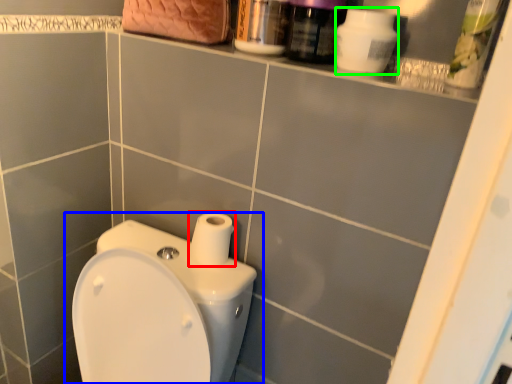
Question: Estimate the real-world distances between objects in this image. Which object is farther from toilet paper (highlighted by a red box), toilet (highlighted by a blue box) or cleaning product (highlighted by a green box)?

Choices:
 (A) toilet
 (B) cleaning product

Answer: (B)